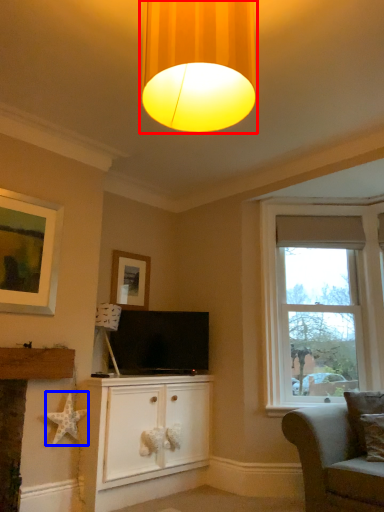
Question: Which of the following is the closest to the observer, lamp (highlighted by a red box) or star (highlighted by a blue box)?

Choices:
 (A) lamp
 (B) star

Answer: (A)